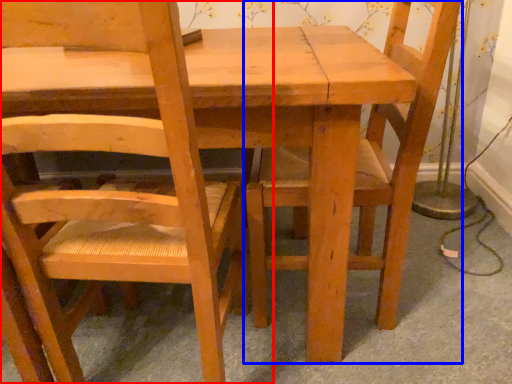
Question: Among these objects, which one is nearest to the camera, chair (highlighted by a red box) or chair (highlighted by a blue box)?

Choices:
 (A) chair
 (B) chair

Answer: (A)